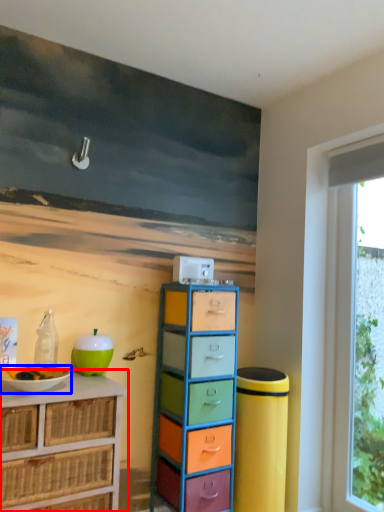
Question: Which object is further to the camera taking this photo, chest of drawers (highlighted by a red box) or bowl (highlighted by a blue box)?

Choices:
 (A) chest of drawers
 (B) bowl

Answer: (B)